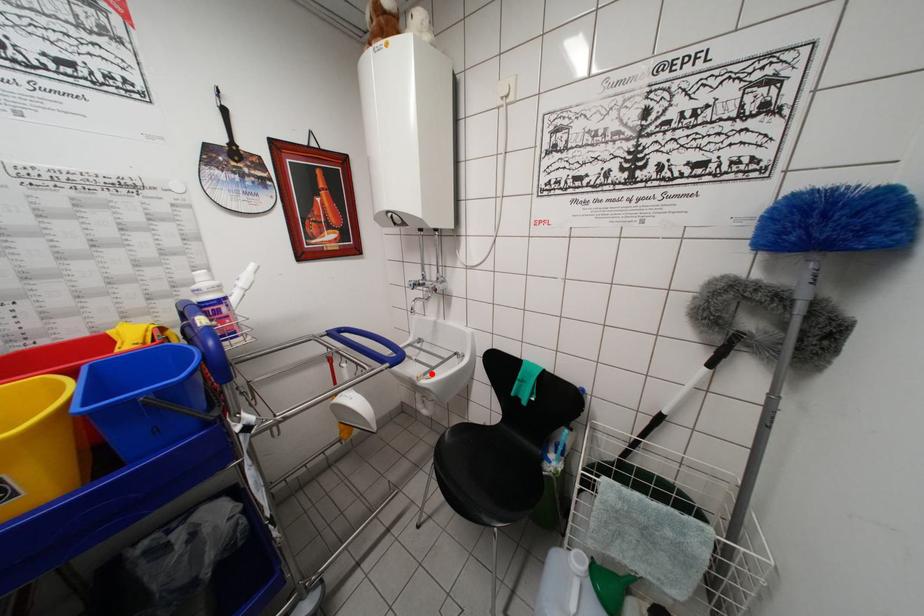
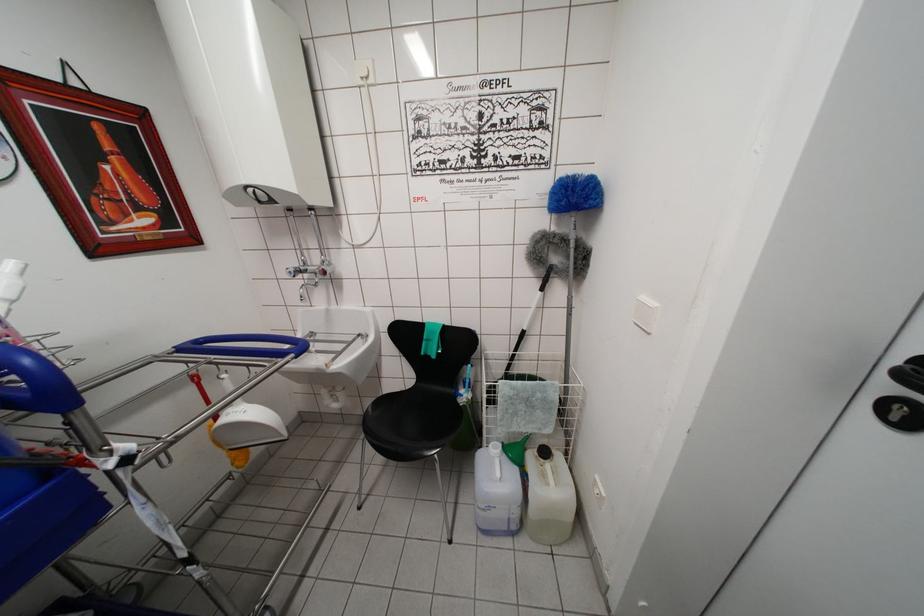
Question: A red point is marked in image1. In image2, is the corresponding 3D point closer to the camera or farther? Reply with the corresponding letter.

Choices:
 (A) The corresponding 3D point is closer.
 (B) The corresponding 3D point is farther.

Answer: (A)